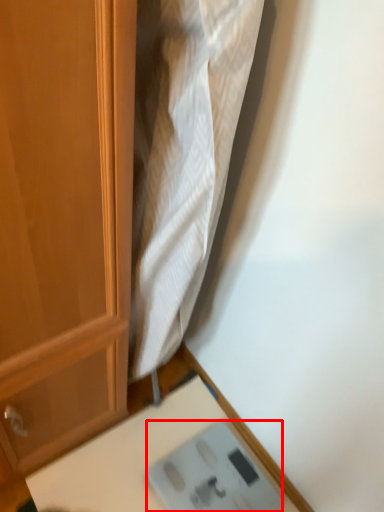
Question: From the image's perspective, what is the correct spatial positioning of scale (annotated by the red box) in reference to table?

Choices:
 (A) above
 (B) below

Answer: (A)